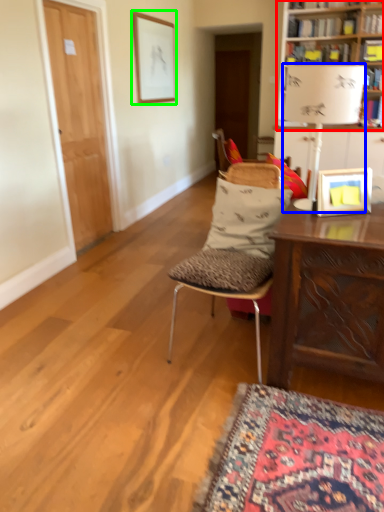
Question: Which is nearer to the bookcase (highlighted by a red box)? lamp (highlighted by a blue box) or picture frame (highlighted by a green box).

Choices:
 (A) lamp
 (B) picture frame

Answer: (A)